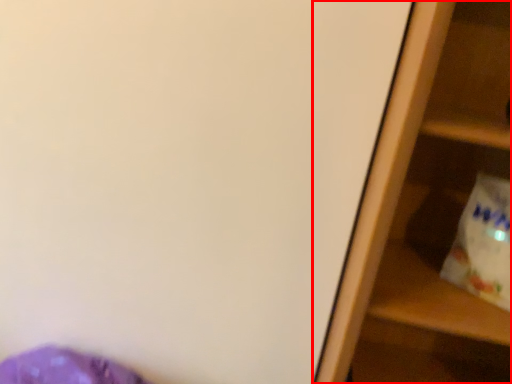
Question: From the image's perspective, where is shelf (annotated by the red box) located in relation to grocery bag in the image?

Choices:
 (A) above
 (B) below

Answer: (B)